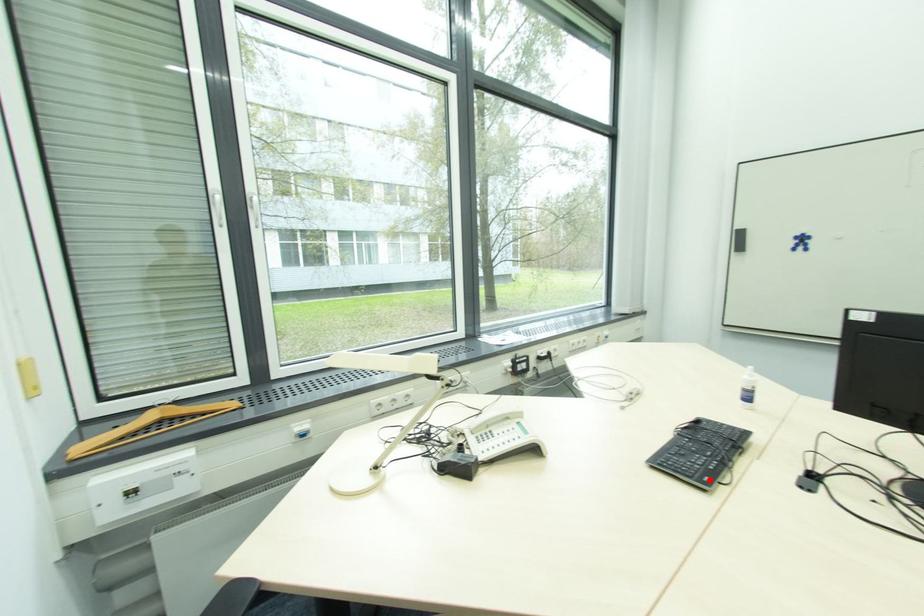
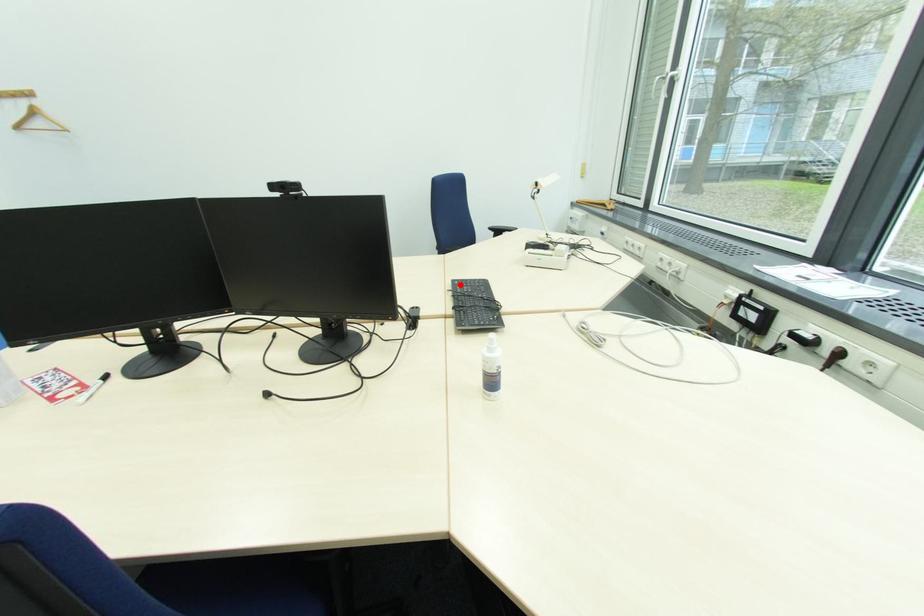
I am providing you with two images of the same scene from different viewpoints. A red point is marked on the first image and another point is marked on the second image. Do the highlighted points in image1 and image2 indicate the same real-world spot?

Yes